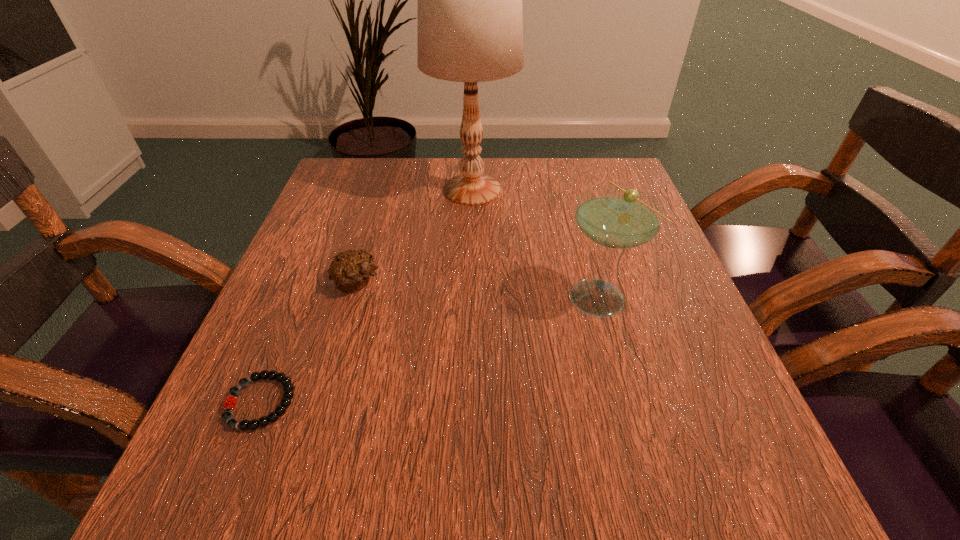
Identify the location of free area in between the lamp and the nearest object. This screenshot has height=540, width=960. (367, 296).

Choose which object is the nearest neighbor to the nearest object. Please provide its 2D coordinates. Your answer should be formatted as a tuple, i.e. [(x, y)], where the tuple contains the x and y coordinates of a point satisfying the conditions above.

[(350, 270)]

I want to click on the third closest object to the third tallest object, so click(615, 217).

Identify the location of vacant space that satisfies the following two spatial constraints: 1. on the back side of the third object from left to right; 2. on the left side of the third tallest object. (384, 190).

Locate an element on the screen. The height and width of the screenshot is (540, 960). vacant area that satisfies the following two spatial constraints: 1. on the back side of the muffin; 2. on the left side of the farthest object is located at coordinates (384, 190).

You are a GUI agent. You are given a task and a screenshot of the screen. Output one action in this format:
    pyautogui.click(x=<x>, y=<y>)
    Task: Click on the blank space that satisfies the following two spatial constraints: 1. on the front side of the third tallest object; 2. on the left side of the rightmost object
    The height and width of the screenshot is (540, 960).
    Given the screenshot: What is the action you would take?
    pyautogui.click(x=353, y=295)